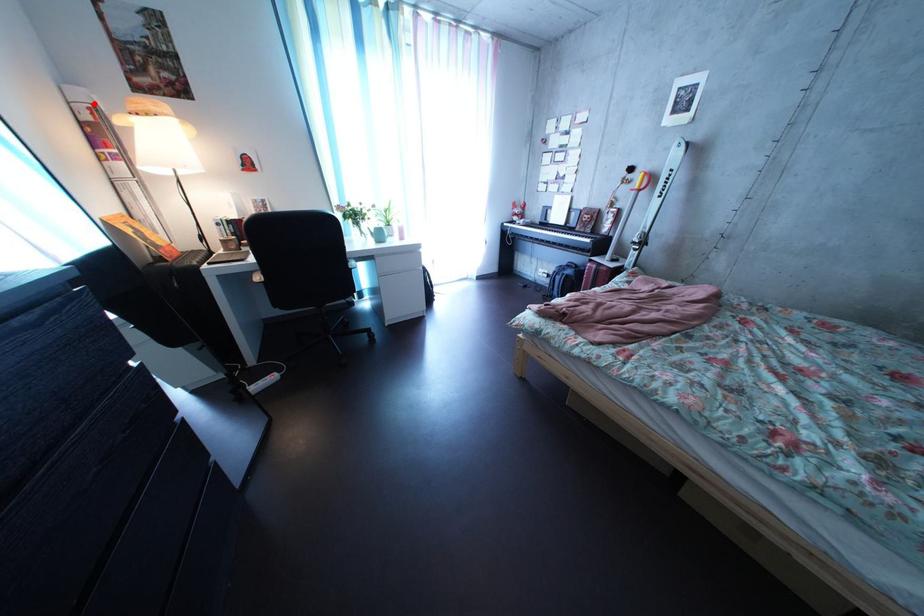
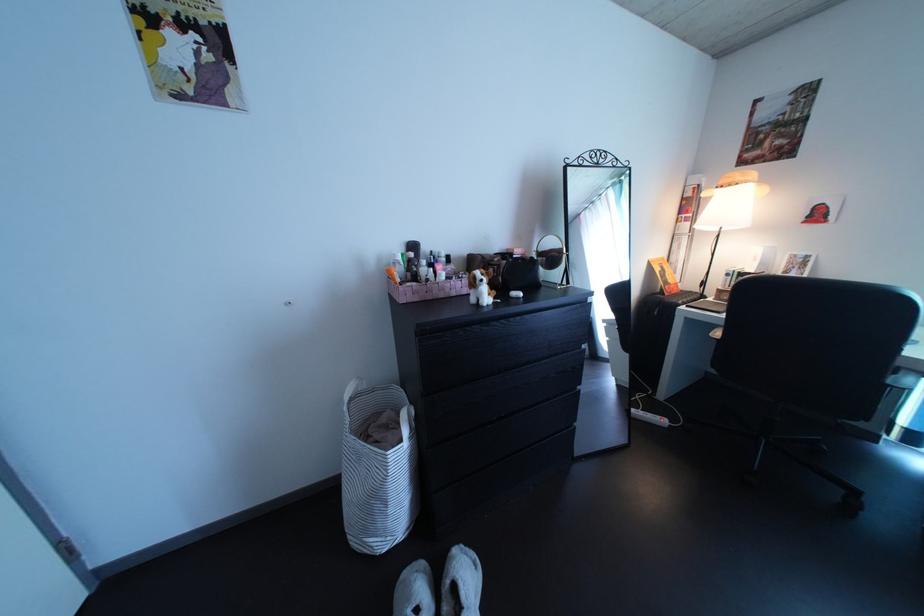
Find the pixel in the second image that matches the highlighted location in the first image.

(709, 188)